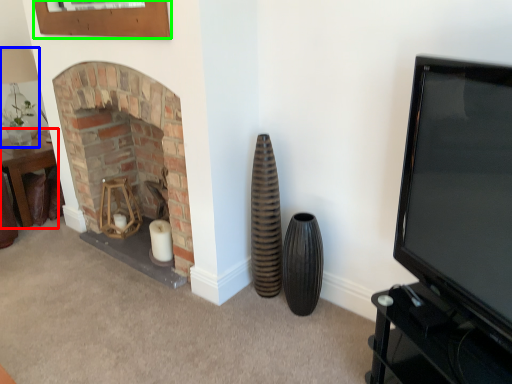
Question: Considering the real-world distances, which object is farthest from table (highlighted by a red box)? lamp (highlighted by a blue box) or picture frame (highlighted by a green box)?

Choices:
 (A) lamp
 (B) picture frame

Answer: (B)